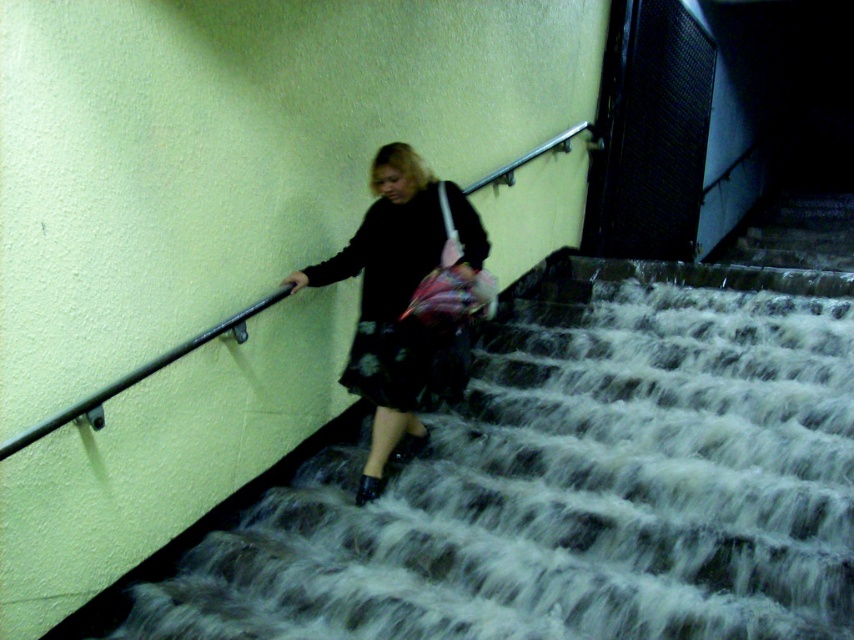
You are a photographer trying to capture the silhouette of the matte black dress at center against the smooth concrete stairs at center. Based on the scene, which object would appear larger in the photo?

The smooth concrete stairs at center would appear larger in the photo because they are wider than the matte black dress at center.

You are standing at the bottom of the staircase in the image and want to reach the point marked at coordinates point (759,435). Given that the staircase has a slope of 30 degrees, how far in feet will you have to walk along the staircase to reach that point?

The point (759,435) is 11.27 feet from the camera. Since the staircase has a slope of 30 degrees, the walking distance along the staircase would be the hypotenuse of a right triangle where the vertical distance is 11.27 feet. Using trigonometry, the distance is 11.27 divided by sin 30 degrees, which equals 22.54 feet. Therefore, you will have to walk 22.54 feet along the staircase to reach the point.

You are standing at the bottom of the smooth concrete stairs at center and want to reach the matte black dress at center. Which direction should you move to get closer to the dress?

Since the smooth concrete stairs at center are closer to the viewer than the matte black dress at center, you should move forward up the stairs to get closer to the matte black dress at center.